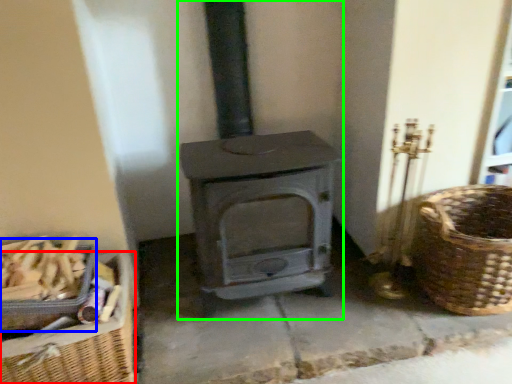
Question: Considering the real-world distances, which object is closest to basket (highlighted by a red box)? basket (highlighted by a blue box) or wood burning stove (highlighted by a green box).

Choices:
 (A) basket
 (B) wood burning stove

Answer: (A)